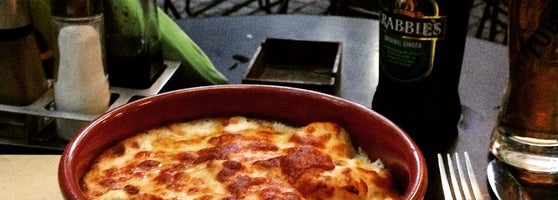
This screenshot has height=200, width=558. Identify the location of counter space between bottle and glass cup. (489, 65).